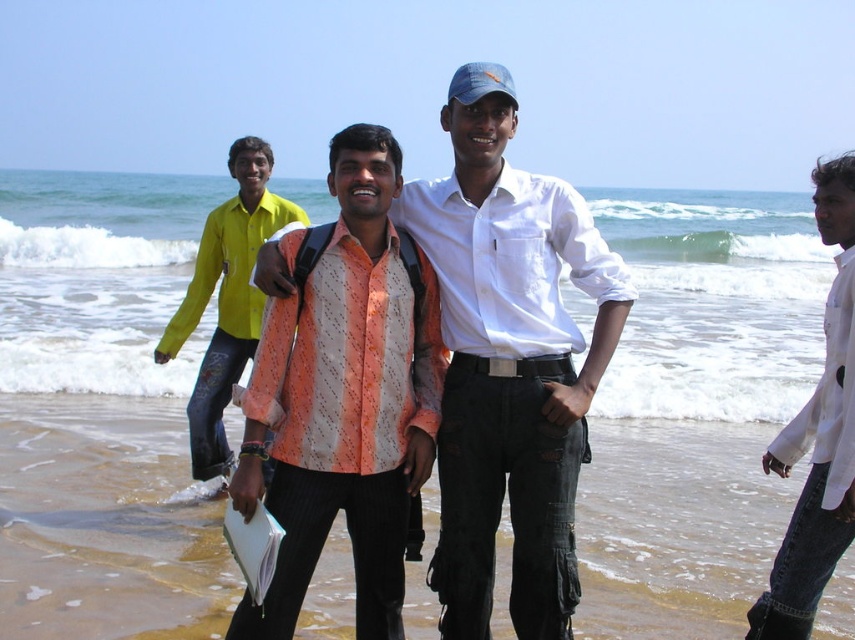
Does patterned fabric shirt at center appear under white cotton shirt at right?

Yes, patterned fabric shirt at center is below white cotton shirt at right.

Can you confirm if patterned fabric shirt at center is positioned above white cotton shirt at right?

Actually, patterned fabric shirt at center is below white cotton shirt at right.

Where is `patterned fabric shirt at center`? This screenshot has width=855, height=640. patterned fabric shirt at center is located at coordinates (345, 400).

Who is more forward, (x=390, y=412) or (x=262, y=228)?

Positioned in front is point (x=390, y=412).

Is patterned fabric shirt at center positioned behind yellow cotton shirt at center?

No.

The width and height of the screenshot is (855, 640). Describe the element at coordinates (345, 400) in the screenshot. I see `patterned fabric shirt at center` at that location.

In order to click on patterned fabric shirt at center in this screenshot , I will do `click(345, 400)`.

Is white cotton shirt at center closer to camera compared to white cotton shirt at right?

No, white cotton shirt at center is behind white cotton shirt at right.

Is white cotton shirt at center bigger than white cotton shirt at right?

Correct, white cotton shirt at center is larger in size than white cotton shirt at right.

Who is more forward, (x=559, y=257) or (x=786, y=451)?

Point (x=786, y=451)

The image size is (855, 640). I want to click on white cotton shirt at center, so click(509, 362).